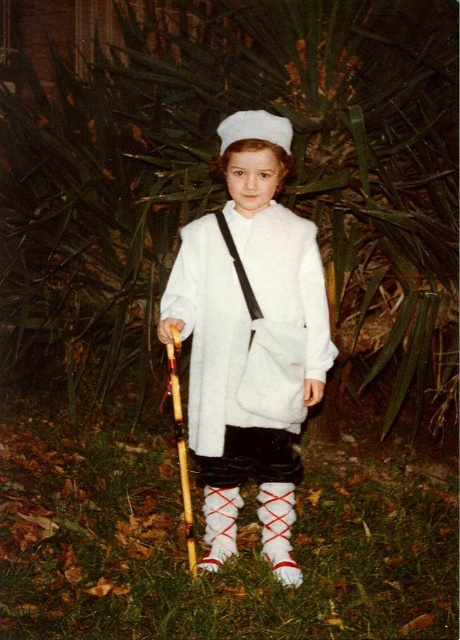
Question: Which of these objects is positioned farthest from the white fuzzy coat at center?

Choices:
 (A) green grass at lower center
 (B) white felt hat at center

Answer: (A)

Question: Does white fuzzy coat at center lie behind white felt hat at center?

Choices:
 (A) yes
 (B) no

Answer: (B)

Question: Is white fuzzy coat at center above white felt hat at center?

Choices:
 (A) no
 (B) yes

Answer: (A)

Question: Estimate the real-world distances between objects in this image. Which object is farther from the green grass at lower center?

Choices:
 (A) white felt hat at center
 (B) white fuzzy coat at center

Answer: (A)

Question: Which of the following is the farthest from the observer?

Choices:
 (A) (263, 358)
 (B) (392, 609)

Answer: (B)

Question: Can you confirm if white fuzzy coat at center is thinner than white felt hat at center?

Choices:
 (A) yes
 (B) no

Answer: (B)